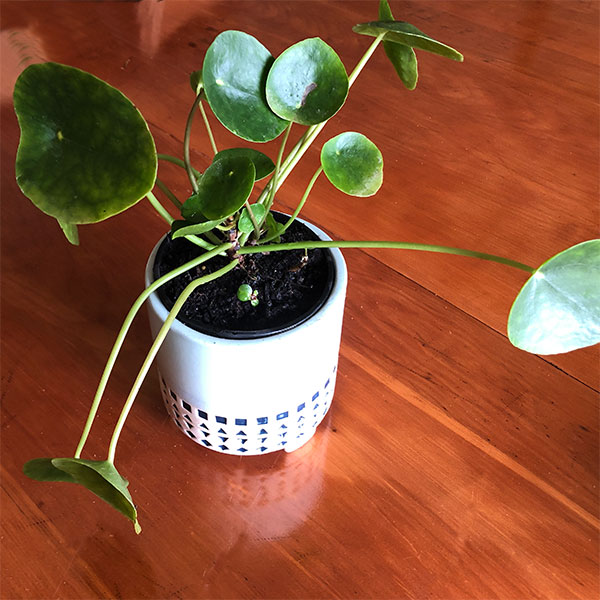
Locate an element on the screen. darker wood is located at coordinates (462, 348).